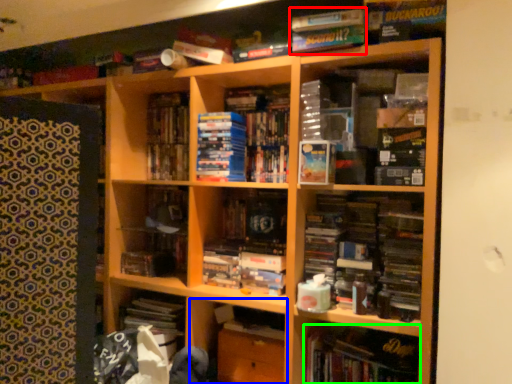
Question: Which is farther away from book (highlighted by a red box)? cabinet (highlighted by a blue box) or book (highlighted by a green box)?

Choices:
 (A) cabinet
 (B) book

Answer: (A)